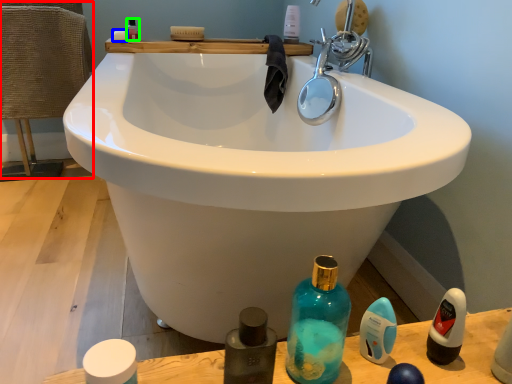
Question: Which is farther away from chair (highlighted by a red box)? soap (highlighted by a blue box) or mouthwash (highlighted by a green box)?

Choices:
 (A) soap
 (B) mouthwash

Answer: (A)